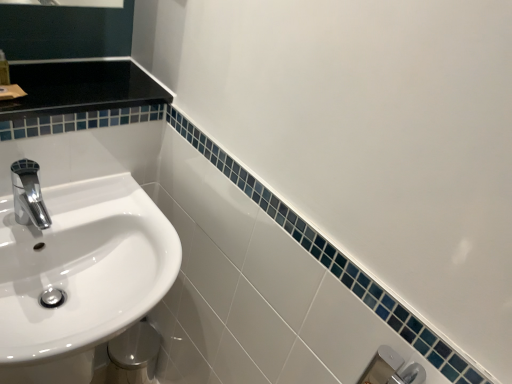
Describe the element at coordinates (80, 277) in the screenshot. I see `white glossy sink at left` at that location.

The height and width of the screenshot is (384, 512). In order to click on chrome/metallic faucet at left in this screenshot , I will do `click(28, 195)`.

Identify the location of translucent plastic soap dispenser at upper left. (4, 70).

From the image's perspective, is white glossy sink at left above or below translucent plastic soap dispenser at upper left?

Based on their image positions, white glossy sink at left is located beneath translucent plastic soap dispenser at upper left.

Which is in front, point (111, 233) or point (4, 74)?

The point (4, 74) is in front.

You are a GUI agent. You are given a task and a screenshot of the screen. Output one action in this format:
    pyautogui.click(x=<x>, y=<y>)
    Task: Click on the sink that appears below the translucent plastic soap dispenser at upper left (from the image's perspective)
    The image size is (512, 384).
    Given the screenshot: What is the action you would take?
    pyautogui.click(x=80, y=277)

Which point is more distant from viewer, [3,73] or [101,258]?

The point [101,258] is more distant.

Who is smaller, translucent plastic soap dispenser at upper left or white glossy sink at left?

Smaller between the two is translucent plastic soap dispenser at upper left.

Can you confirm if translucent plastic soap dispenser at upper left is positioned to the left of white glossy sink at left?

Indeed, translucent plastic soap dispenser at upper left is positioned on the left side of white glossy sink at left.

Is translucent plastic soap dispenser at upper left next to white glossy sink at left?

No, translucent plastic soap dispenser at upper left is not making contact with white glossy sink at left.

Is chrome/metallic faucet at left behind translucent plastic soap dispenser at upper left?

No, it is in front of translucent plastic soap dispenser at upper left.

Where is `toiletry above the chrome/metallic faucet at left (from a real-world perspective)`? This screenshot has width=512, height=384. toiletry above the chrome/metallic faucet at left (from a real-world perspective) is located at coordinates (4, 70).

From the picture: Which of these two, chrome/metallic faucet at left or translucent plastic soap dispenser at upper left, is thinner?

With smaller width is translucent plastic soap dispenser at upper left.

From a real-world perspective, between chrome/metallic faucet at left and translucent plastic soap dispenser at upper left, who is vertically higher?

In real-world perspective, translucent plastic soap dispenser at upper left is above.

Considering the relative sizes of white glossy sink at left and chrome/metallic faucet at left in the image provided, is white glossy sink at left thinner than chrome/metallic faucet at left?

No.

Is white glossy sink at left taller than chrome/metallic faucet at left?

Yes, white glossy sink at left is taller than chrome/metallic faucet at left.

Is white glossy sink at left positioned in front of chrome/metallic faucet at left?

Yes, white glossy sink at left is closer to the camera.

Considering the positions of objects translucent plastic soap dispenser at upper left and chrome/metallic faucet at left in the image provided, who is more to the left, translucent plastic soap dispenser at upper left or chrome/metallic faucet at left?

Positioned to the left is translucent plastic soap dispenser at upper left.

Who is more distant, translucent plastic soap dispenser at upper left or chrome/metallic faucet at left?

translucent plastic soap dispenser at upper left is more distant.

Are translucent plastic soap dispenser at upper left and chrome/metallic faucet at left located far from each other?

translucent plastic soap dispenser at upper left is near chrome/metallic faucet at left, not far away.

Find the location of a particular element. tap beneath the translucent plastic soap dispenser at upper left (from a real-world perspective) is located at coordinates (28, 195).

Does chrome/metallic faucet at left have a larger size compared to white glossy sink at left?

Incorrect, chrome/metallic faucet at left is not larger than white glossy sink at left.

From the image's perspective, is chrome/metallic faucet at left above or below white glossy sink at left?

Clearly, from the image's perspective, chrome/metallic faucet at left is above white glossy sink at left.

Based on the photo, between chrome/metallic faucet at left and white glossy sink at left, which one has less height?

With less height is chrome/metallic faucet at left.

Is chrome/metallic faucet at left outside of white glossy sink at left?

Yes.

This screenshot has width=512, height=384. What are the coordinates of `sink below the translucent plastic soap dispenser at upper left (from the image's perspective)` in the screenshot? It's located at (80, 277).

Where is `toiletry that appears on the left of white glossy sink at left`? Image resolution: width=512 pixels, height=384 pixels. toiletry that appears on the left of white glossy sink at left is located at coordinates (4, 70).

Which object lies further to the anchor point white glossy sink at left, chrome/metallic faucet at left or translucent plastic soap dispenser at upper left?

Among the two, translucent plastic soap dispenser at upper left is located further to white glossy sink at left.

Based on their spatial positions, is chrome/metallic faucet at left or white glossy sink at left further from translucent plastic soap dispenser at upper left?

white glossy sink at left is positioned further to the anchor translucent plastic soap dispenser at upper left.

Based on their spatial positions, is translucent plastic soap dispenser at upper left or chrome/metallic faucet at left further from white glossy sink at left?

translucent plastic soap dispenser at upper left is further to white glossy sink at left.

From the image, which object appears to be nearer to translucent plastic soap dispenser at upper left, white glossy sink at left or chrome/metallic faucet at left?

chrome/metallic faucet at left is closer to translucent plastic soap dispenser at upper left.

Looking at the image, which one is located closer to chrome/metallic faucet at left, white glossy sink at left or translucent plastic soap dispenser at upper left?

white glossy sink at left is closer to chrome/metallic faucet at left.

Which object lies nearer to the anchor point chrome/metallic faucet at left, translucent plastic soap dispenser at upper left or white glossy sink at left?

white glossy sink at left is closer to chrome/metallic faucet at left.

At what (x,y) coordinates should I click in order to perform the action: click on tap between translucent plastic soap dispenser at upper left and white glossy sink at left in the vertical direction. Please return your answer as a coordinate pair (x, y). Image resolution: width=512 pixels, height=384 pixels. Looking at the image, I should click on (28, 195).